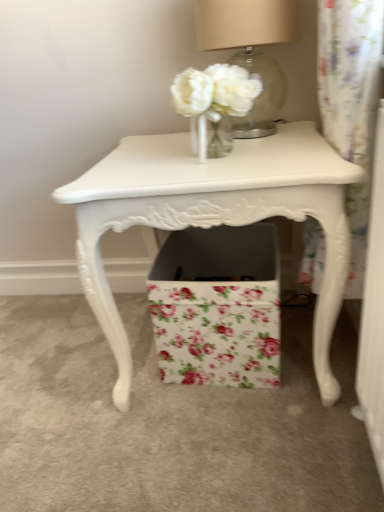
Locate an element on the screen. Image resolution: width=384 pixels, height=512 pixels. blank area to the left of floral paper box at center is located at coordinates (106, 384).